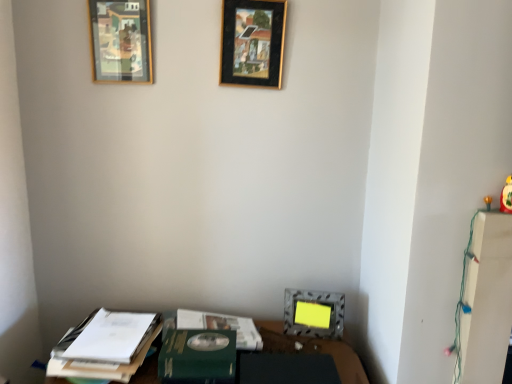
Question: From a real-world perspective, is yellow matte toy at right physically located above or below wooden frame at upper left, the 3th picture frame in the bottom-to-top sequence?

Choices:
 (A) below
 (B) above

Answer: (A)

Question: Do you think yellow matte toy at right is within wooden frame at upper left, the 3th picture frame in the bottom-to-top sequence, or outside of it?

Choices:
 (A) outside
 (B) inside

Answer: (A)

Question: Which is nearer to the metallic silver picture frame at lower center, the 3th picture frame from the top?

Choices:
 (A) yellow matte toy at right
 (B) green matte paperback book at lower center
 (C) black matte picture frame at upper center, which is the 2th picture frame in top-to-bottom order
 (D) green matte journal at lower center
 (E) wooden frame at upper left, which is the first picture frame in left-to-right order

Answer: (D)

Question: Based on their relative distances, which object is farther from the metallic silver picture frame at lower center, positioned as the 3th picture frame in left-to-right order?

Choices:
 (A) black matte picture frame at upper center, the second picture frame in the bottom-to-top sequence
 (B) green matte journal at lower center
 (C) yellow matte toy at right
 (D) wooden frame at upper left, which is the first picture frame in left-to-right order
 (E) green matte paperback book at lower center

Answer: (D)